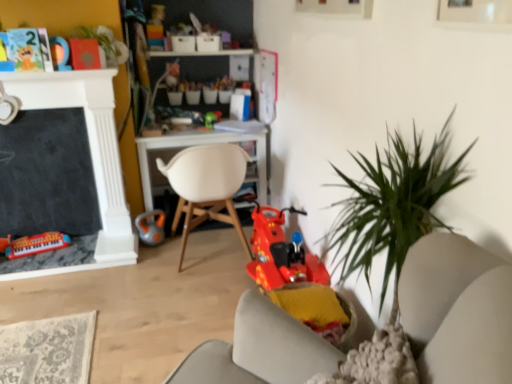
Question: Considering the relative sizes of green leafy plant at upper left and orange rubber kettlebell at center, the third toy positioned from the bottom, in the image provided, is green leafy plant at upper left smaller than orange rubber kettlebell at center, the third toy positioned from the bottom,?

Choices:
 (A) yes
 (B) no

Answer: (B)

Question: Considering the relative sizes of green leafy plant at upper left and orange rubber kettlebell at center, the 3th toy viewed from the top, in the image provided, is green leafy plant at upper left wider than orange rubber kettlebell at center, the 3th toy viewed from the top,?

Choices:
 (A) no
 (B) yes

Answer: (B)

Question: Is orange rubber kettlebell at center, acting as the 3th toy starting from the right, completely or partially inside green leafy plant at upper left?

Choices:
 (A) no
 (B) yes

Answer: (A)

Question: Does green leafy plant at upper left have a greater height compared to orange rubber kettlebell at center, the third toy positioned from the bottom?

Choices:
 (A) no
 (B) yes

Answer: (A)

Question: Is green leafy plant at upper left facing towards orange rubber kettlebell at center, the third toy positioned from the bottom?

Choices:
 (A) yes
 (B) no

Answer: (B)

Question: From the image's perspective, is green leafy plant at upper left located beneath orange rubber kettlebell at center, placed as the third toy when sorted from left to right?

Choices:
 (A) yes
 (B) no

Answer: (B)

Question: From a real-world perspective, is orange rubber kettlebell at center, the 3th toy viewed from the top, physically above matte plastic toy at upper left, which ranks as the 1th toy in top-to-bottom order?

Choices:
 (A) no
 (B) yes

Answer: (A)

Question: Does orange rubber kettlebell at center, placed as the third toy when sorted from left to right, turn towards matte plastic toy at upper left, which is the fourth toy in right-to-left order?

Choices:
 (A) no
 (B) yes

Answer: (A)

Question: From the image's perspective, is orange rubber kettlebell at center, acting as the 3th toy starting from the right, over matte plastic toy at upper left, which ranks as the 1th toy in top-to-bottom order?

Choices:
 (A) no
 (B) yes

Answer: (A)

Question: From a real-world perspective, is orange rubber kettlebell at center, acting as the 3th toy starting from the right, beneath matte plastic toy at upper left, positioned as the 5th toy in bottom-to-top order?

Choices:
 (A) yes
 (B) no

Answer: (A)

Question: Considering the relative sizes of orange rubber kettlebell at center, the 3th toy viewed from the top, and matte plastic toy at upper left, which is the fourth toy in right-to-left order, in the image provided, is orange rubber kettlebell at center, the 3th toy viewed from the top, smaller than matte plastic toy at upper left, which is the fourth toy in right-to-left order,?

Choices:
 (A) no
 (B) yes

Answer: (A)

Question: Considering the relative positions of orange rubber kettlebell at center, placed as the third toy when sorted from left to right, and matte plastic toy at upper left, which is the fourth toy in right-to-left order, in the image provided, is orange rubber kettlebell at center, placed as the third toy when sorted from left to right, behind matte plastic toy at upper left, which is the fourth toy in right-to-left order,?

Choices:
 (A) yes
 (B) no

Answer: (A)

Question: Is orange rubber kettlebell at center, acting as the 3th toy starting from the right, facing towards matte plastic keyboard at lower left, the fifth toy positioned from the top?

Choices:
 (A) yes
 (B) no

Answer: (B)